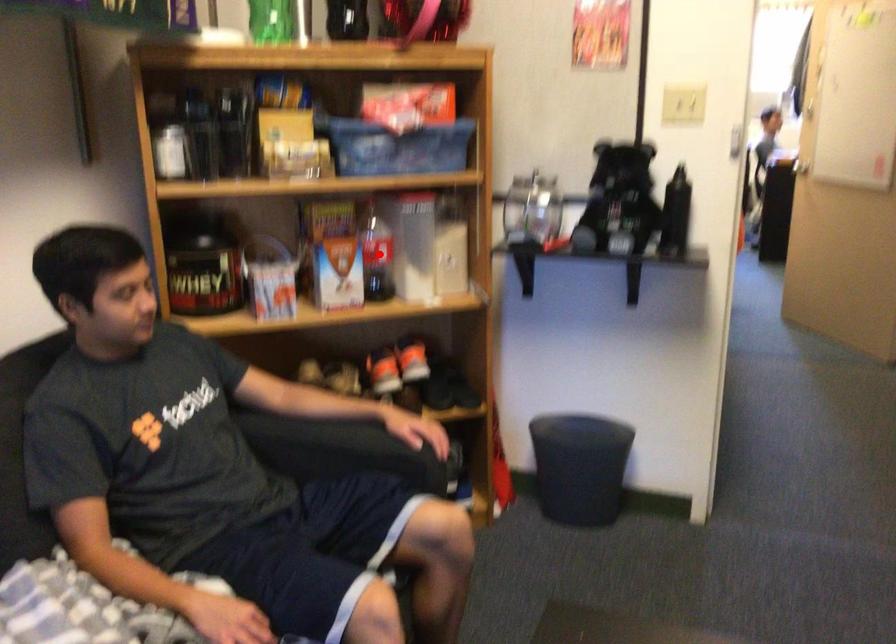
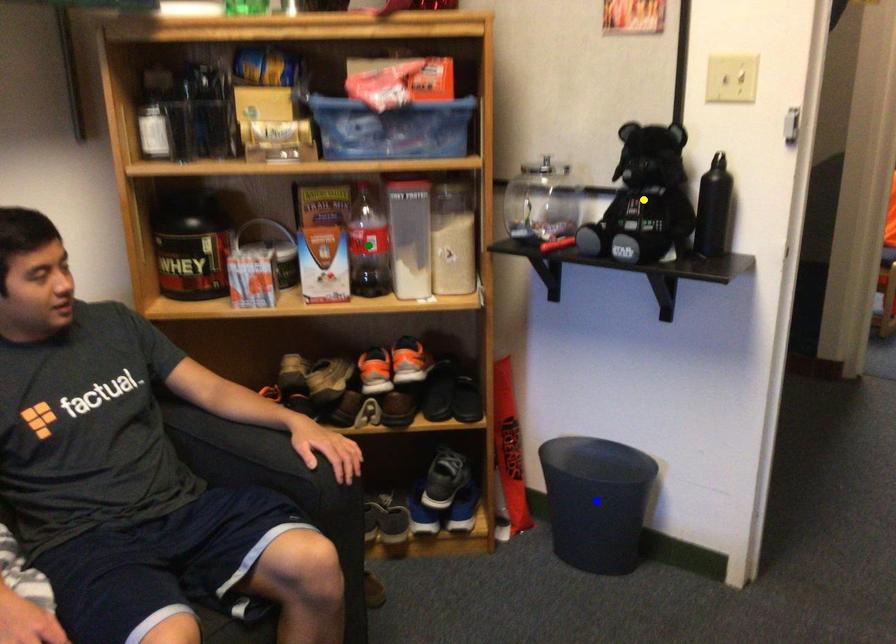
Question: I am providing you with two images of the same scene from different viewpoints. A red point is marked on the first image. You are given multiple points on the second image. Can you choose the point in image 2 that corresponds to the point in image 1?

Choices:
 (A) green point
 (B) yellow point
 (C) blue point

Answer: (A)